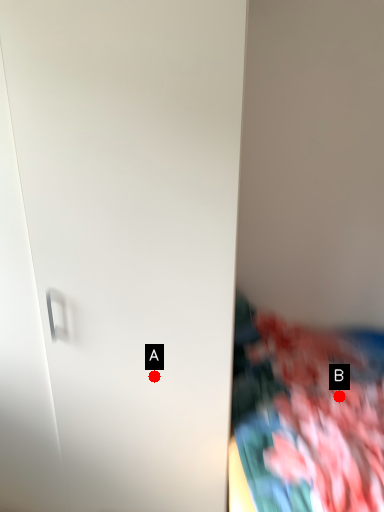
Question: Two points are circled on the image, labeled by A and B beside each circle. Which point is closer to the camera?

Choices:
 (A) A is closer
 (B) B is closer

Answer: (A)